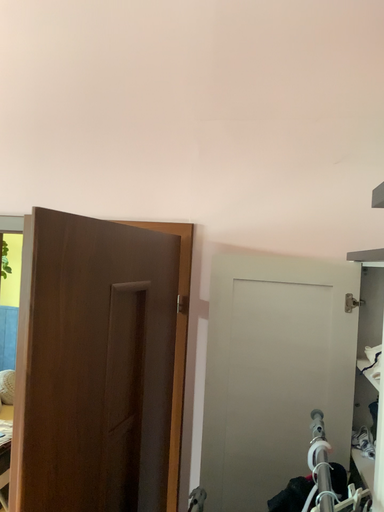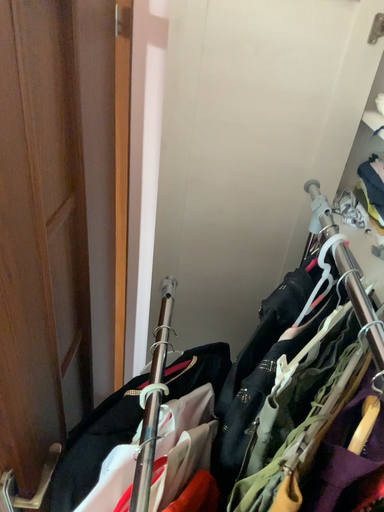
Question: How did the camera likely rotate when shooting the video?

Choices:
 (A) rotated downward
 (B) rotated upward

Answer: (A)